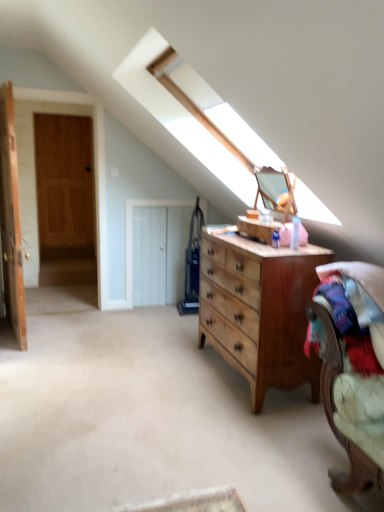
Question: Is wooden door at left, placed as the second door when sorted from left to right, taller than white wooden door at center, positioned as the 3th door in left-to-right order?

Choices:
 (A) yes
 (B) no

Answer: (A)

Question: Is white wooden door at center, which appears as the 1th door when viewed from the right, inside wooden door at left, placed as the second door when sorted from left to right?

Choices:
 (A) yes
 (B) no

Answer: (B)

Question: From a real-world perspective, is wooden door at left, placed as the second door when sorted from left to right, positioned under white wooden door at center, which appears as the 1th door when viewed from the right, based on gravity?

Choices:
 (A) no
 (B) yes

Answer: (A)

Question: Is wooden door at left, placed as the second door when sorted from left to right, bigger than white wooden door at center, positioned as the 3th door in left-to-right order?

Choices:
 (A) no
 (B) yes

Answer: (B)

Question: Is wooden door at left, placed as the second door when sorted from left to right, oriented away from white wooden door at center, which appears as the 1th door when viewed from the right?

Choices:
 (A) no
 (B) yes

Answer: (A)

Question: Does wooden door at left, placed as the second door when sorted from left to right, have a lesser width compared to white wooden door at center, positioned as the 3th door in left-to-right order?

Choices:
 (A) yes
 (B) no

Answer: (B)

Question: Considering the relative sizes of white wooden door at center, which appears as the 1th door when viewed from the right, and wooden door at left, which ranks as the 3th door in right-to-left order, in the image provided, is white wooden door at center, which appears as the 1th door when viewed from the right, smaller than wooden door at left, which ranks as the 3th door in right-to-left order,?

Choices:
 (A) yes
 (B) no

Answer: (A)

Question: Is white wooden door at center, which appears as the 1th door when viewed from the right, further to camera compared to wooden door at left, which ranks as the 3th door in right-to-left order?

Choices:
 (A) yes
 (B) no

Answer: (A)

Question: Is white wooden door at center, which appears as the 1th door when viewed from the right, shorter than wooden door at left, placed as the first door when sorted from left to right?

Choices:
 (A) yes
 (B) no

Answer: (A)

Question: Considering the relative positions of white wooden door at center, which appears as the 1th door when viewed from the right, and wooden door at left, which ranks as the 3th door in right-to-left order, in the image provided, is white wooden door at center, which appears as the 1th door when viewed from the right, to the right of wooden door at left, which ranks as the 3th door in right-to-left order, from the viewer's perspective?

Choices:
 (A) yes
 (B) no

Answer: (A)

Question: Can wooden door at left, which ranks as the 3th door in right-to-left order, be found inside white wooden door at center, which appears as the 1th door when viewed from the right?

Choices:
 (A) yes
 (B) no

Answer: (B)

Question: Can we say white wooden door at center, positioned as the 3th door in left-to-right order, lies outside wooden door at left, placed as the first door when sorted from left to right?

Choices:
 (A) yes
 (B) no

Answer: (A)

Question: Is the depth of velvet-like beige armchair at lower right less than that of white wooden door at center, positioned as the 3th door in left-to-right order?

Choices:
 (A) no
 (B) yes

Answer: (B)